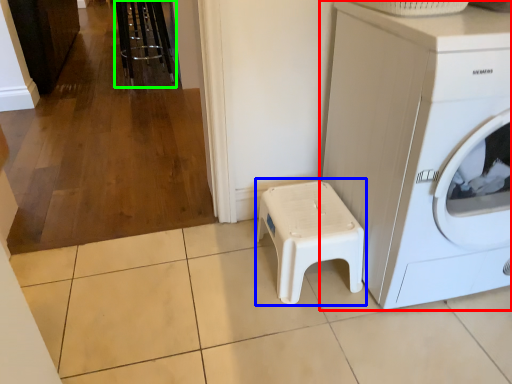
Question: Based on their relative distances, which object is farther from washing machine (highlighted by a red box)? Choose from music stool (highlighted by a blue box) and bar stool (highlighted by a green box).

Choices:
 (A) music stool
 (B) bar stool

Answer: (B)